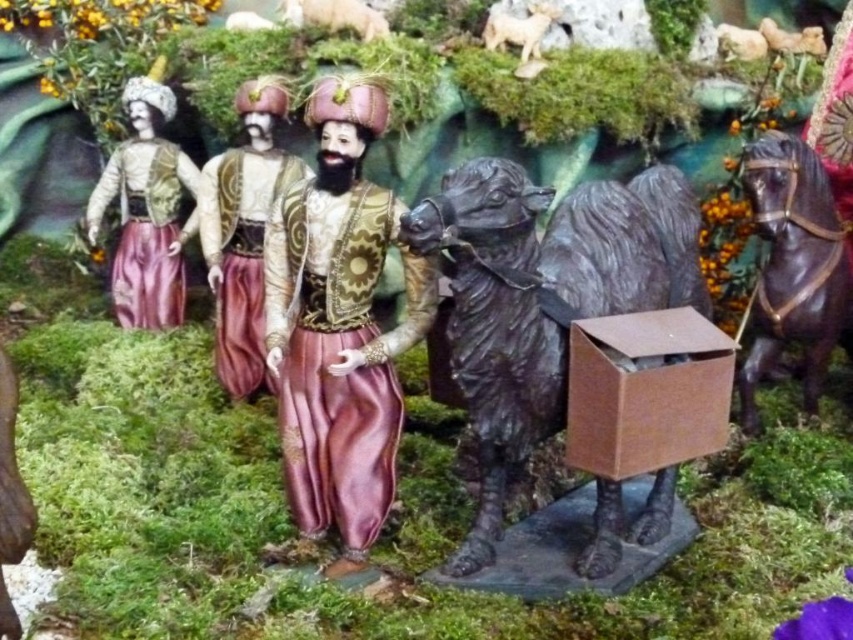
Who is positioned more to the right, shiny brown horse at right or white woolly sheep at upper center?

shiny brown horse at right is more to the right.

From the picture: Which of these two, shiny brown horse at right or white woolly sheep at upper center, stands shorter?

With less height is white woolly sheep at upper center.

You are a GUI agent. You are given a task and a screenshot of the screen. Output one action in this format:
    pyautogui.click(x=<x>, y=<y>)
    Task: Click on the shiny brown horse at right
    
    Given the screenshot: What is the action you would take?
    pyautogui.click(x=793, y=266)

Is brown matte camel at center smaller than matte gold fabric at left?

No, brown matte camel at center is not smaller than matte gold fabric at left.

Which is behind, point (616, 532) or point (166, 92)?

Positioned behind is point (166, 92).

Locate an element on the screen. This screenshot has width=853, height=640. brown matte camel at center is located at coordinates (x=541, y=301).

Which is more to the right, shiny gold vest at center or brown cardboard box at center?

Positioned to the right is brown cardboard box at center.

Locate an element on the screen. The width and height of the screenshot is (853, 640). shiny gold vest at center is located at coordinates (339, 324).